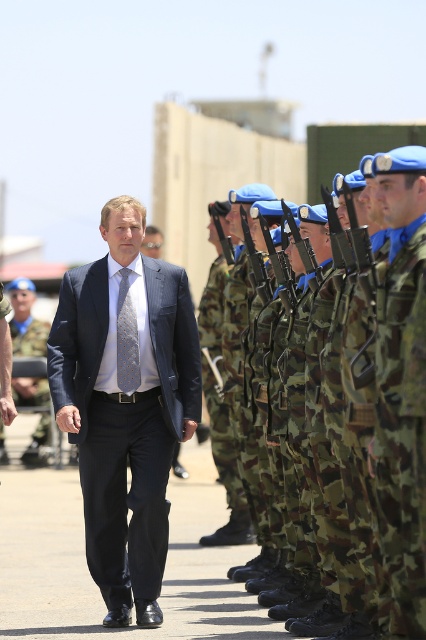
Can you confirm if camo fabric uniform at center is smaller than matte black suit at center?

No.

Is camo fabric uniform at center bigger than matte black suit at center?

Yes.

What do you see at coordinates (400, 385) in the screenshot? I see `camo fabric uniform at center` at bounding box center [400, 385].

Find the location of a particular element. The height and width of the screenshot is (640, 426). camo fabric uniform at center is located at coordinates (400, 385).

Is the position of matte black suit at center less distant than that of silver textured tie at center?

No, matte black suit at center is further to the viewer.

Who is positioned more to the left, matte black suit at center or silver textured tie at center?

From the viewer's perspective, matte black suit at center appears more on the left side.

Is point (43, 456) closer to camera compared to point (124, 385)?

No.

The height and width of the screenshot is (640, 426). I want to click on matte black suit at center, so click(25, 321).

Looking at this image, between navy blue suit at center and camo fabric uniform at center, which one has more height?

With more height is navy blue suit at center.

Can you confirm if navy blue suit at center is positioned to the right of camo fabric uniform at center?

Incorrect, navy blue suit at center is not on the right side of camo fabric uniform at center.

Does point (104, 483) come farther from viewer compared to point (406, 353)?

Yes, it is.

Identify the location of navy blue suit at center. The width and height of the screenshot is (426, 640). (124, 406).